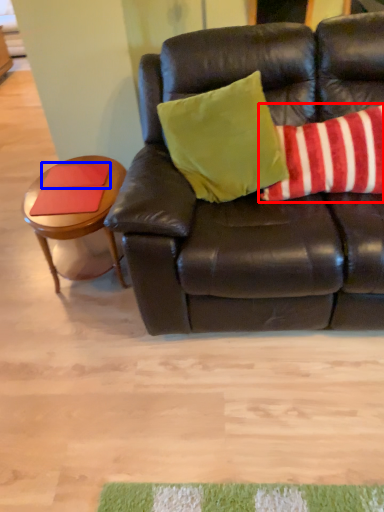
Question: Among these objects, which one is farthest to the camera, pillow (highlighted by a red box) or pad (highlighted by a blue box)?

Choices:
 (A) pillow
 (B) pad

Answer: (B)